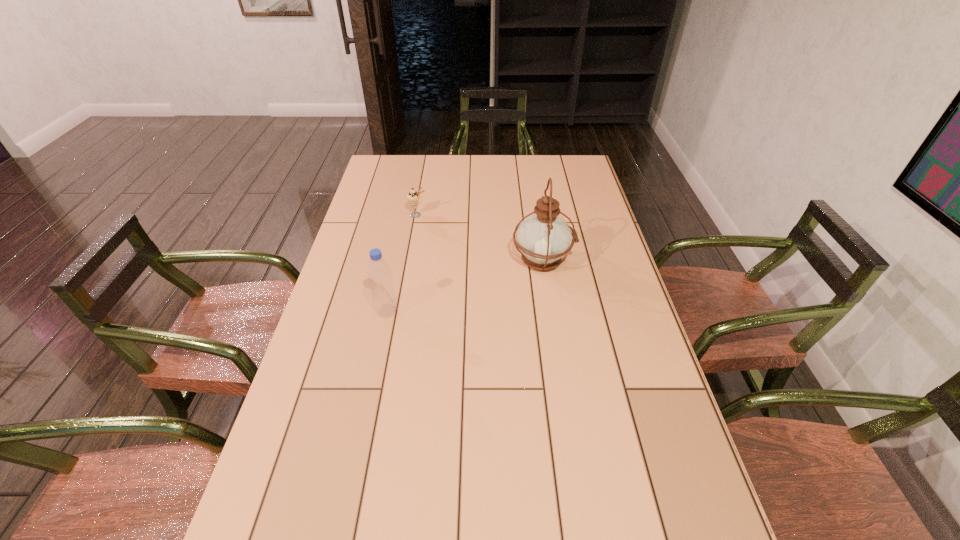
Identify the location of the rightmost object. coord(543,238).

I want to click on the tallest object, so click(543, 238).

Locate an element on the screen. Image resolution: width=960 pixels, height=540 pixels. the nearest object is located at coordinates coord(379,274).

What are the coordinates of `bottle` in the screenshot? It's located at (379, 274).

Where is `the shortest object`? This screenshot has width=960, height=540. the shortest object is located at coordinates (413, 197).

Where is `icecream`? Image resolution: width=960 pixels, height=540 pixels. icecream is located at coordinates (413, 197).

The height and width of the screenshot is (540, 960). Identify the location of free space located on the back of the second farthest object. (536, 216).

Identify the location of vacant point located on the right of the nearest object. This screenshot has height=540, width=960. (444, 311).

I want to click on vacant space located 0.260m on the right of the shortest object, so click(499, 215).

The image size is (960, 540). I want to click on object situated at the left edge, so [379, 274].